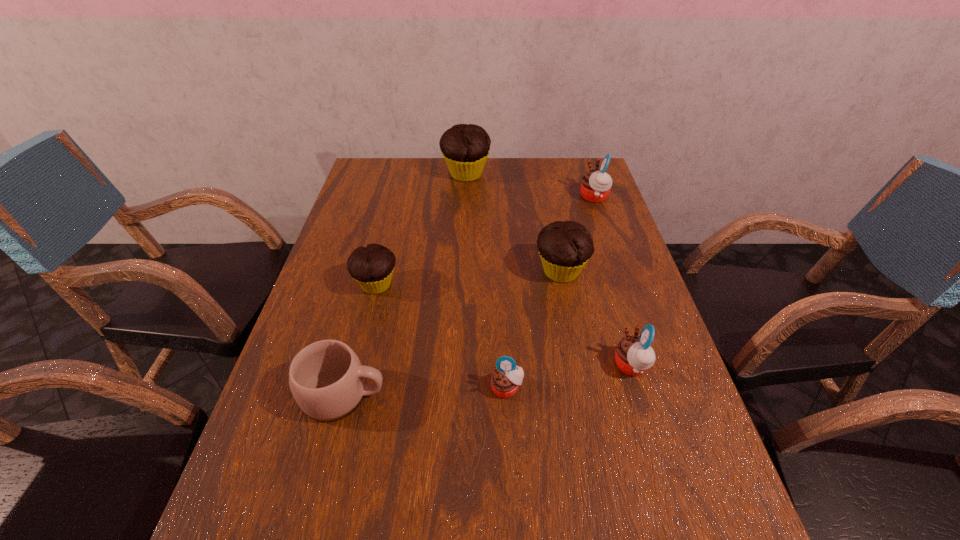
The width and height of the screenshot is (960, 540). I want to click on the shortest object, so click(507, 376).

This screenshot has height=540, width=960. I want to click on the shortest muffin, so click(x=507, y=376).

Image resolution: width=960 pixels, height=540 pixels. In order to click on free space located on the right of the farthest muffin in this screenshot , I will do `click(564, 174)`.

Identify the location of vacant space located 0.160m on the front-facing side of the biggest pink muffin. (531, 197).

The width and height of the screenshot is (960, 540). I want to click on vacant space located 0.250m on the front-facing side of the biggest pink muffin, so tap(503, 197).

This screenshot has height=540, width=960. I want to click on free space located 0.250m on the front-facing side of the biggest pink muffin, so click(503, 197).

Where is `vacant area situated on the front of the rightmost chocolate muffin`? Image resolution: width=960 pixels, height=540 pixels. vacant area situated on the front of the rightmost chocolate muffin is located at coordinates (569, 318).

Identify the location of free space located 0.360m on the front-facing side of the second biggest pink muffin. The image size is (960, 540). (448, 366).

Identify the location of free space located 0.350m on the front-facing side of the second biggest pink muffin. Image resolution: width=960 pixels, height=540 pixels. (453, 366).

You are a GUI agent. You are given a task and a screenshot of the screen. Output one action in this format:
    pyautogui.click(x=<x>, y=<y>)
    Task: Click on the vacant space located on the front-facing side of the second biggest pink muffin
    
    Given the screenshot: What is the action you would take?
    pyautogui.click(x=590, y=366)